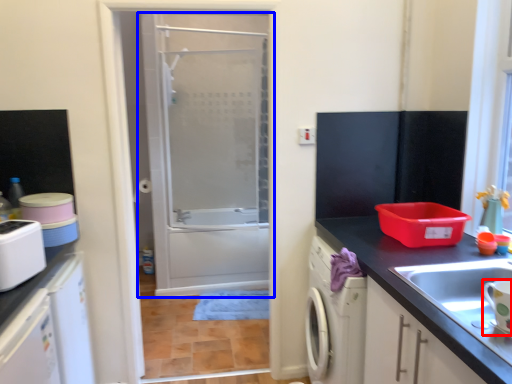
Question: Which object appears farthest to the camera in this image, appliance (highlighted by a red box) or door (highlighted by a blue box)?

Choices:
 (A) appliance
 (B) door

Answer: (B)